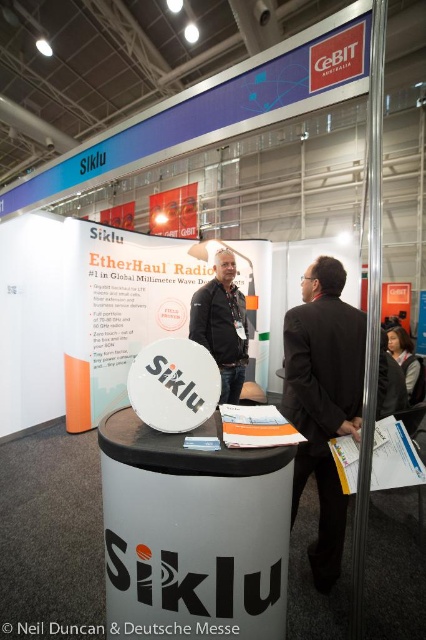
Who is lower down, dark gray jacket at center or orange paper portfolio at center?

Positioned lower is orange paper portfolio at center.

Who is shorter, dark gray jacket at center or orange paper portfolio at center?

Standing shorter between the two is orange paper portfolio at center.

Which is in front, point (201, 288) or point (230, 444)?

Point (230, 444) is in front.

At what (x,y) coordinates should I click in order to perform the action: click on dark gray jacket at center. Please return your answer as a coordinate pair (x, y). This screenshot has width=426, height=640. Looking at the image, I should click on (221, 324).

Does black suit at center have a lesser height compared to white paper at center?

No.

Is point (325, 358) more distant than point (348, 444)?

Yes, it is behind point (348, 444).

Where is `black suit at center`? black suit at center is located at coordinates (322, 401).

From the picture: Is dark gray jacket at center to the right of white paper at center from the viewer's perspective?

In fact, dark gray jacket at center is to the left of white paper at center.

Does point (215, 272) come in front of point (386, 476)?

No.

What do you see at coordinates (221, 324) in the screenshot?
I see `dark gray jacket at center` at bounding box center [221, 324].

Find the location of a particular element. dark gray jacket at center is located at coordinates (221, 324).